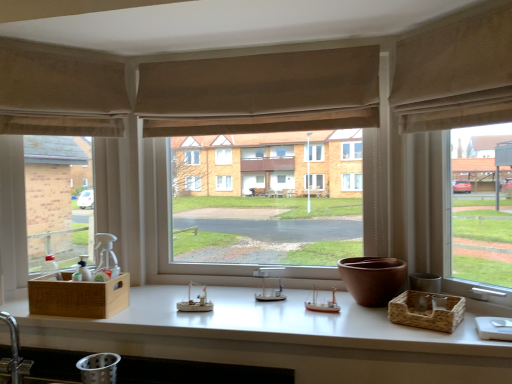
At what (x,y) coordinates should I click in order to perform the action: click on silver metallic faucet at lower left. Please return your answer as a coordinate pair (x, y). Looking at the image, I should click on (13, 345).

How much space does matte beige curtain at center, acting as the 2th window starting from the left, occupy vertically?

3.41 feet.

Identify the location of brown woven basket at right, the 2th basket from the left. point(426,311).

Image resolution: width=512 pixels, height=384 pixels. I want to click on vase behind the white matte countertop at center, so click(372, 279).

Is brown matte vase at center at the back of white matte countertop at center?

No, brown matte vase at center is not at the back of white matte countertop at center.

From a real-world perspective, is white matte countertop at center over brown matte vase at center?

No, from a real-world perspective, white matte countertop at center is not over brown matte vase at center

Considering the positions of objects matte beige curtain at center, acting as the 2th window starting from the left, and white matte countertop at center in the image provided, who is more to the left, matte beige curtain at center, acting as the 2th window starting from the left, or white matte countertop at center?

white matte countertop at center.

Would you say matte beige curtain at center, acting as the 2th window starting from the left, is inside or outside white matte countertop at center?

matte beige curtain at center, acting as the 2th window starting from the left, lies outside white matte countertop at center.

Is matte beige curtain at center, placed as the 2th window when sorted from right to left, facing away from white matte countertop at center?

No, matte beige curtain at center, placed as the 2th window when sorted from right to left, is not facing away from white matte countertop at center.

From the image's perspective, is brown matte vase at center on matte beige curtain at center, acting as the 2th window starting from the left?

No, from the image's perspective, brown matte vase at center is not on top of matte beige curtain at center, acting as the 2th window starting from the left.

From the picture: Considering the positions of objects brown matte vase at center and matte beige curtain at center, placed as the 2th window when sorted from right to left, in the image provided, who is in front, brown matte vase at center or matte beige curtain at center, placed as the 2th window when sorted from right to left,?

Positioned in front is brown matte vase at center.

From a real-world perspective, which is physically above, brown matte vase at center or matte beige curtain at center, acting as the 2th window starting from the left?

matte beige curtain at center, acting as the 2th window starting from the left, is physically above.

In the image, is brown matte vase at center on the left side or the right side of matte beige curtain at center, placed as the 2th window when sorted from right to left?

Clearly, brown matte vase at center is on the right of matte beige curtain at center, placed as the 2th window when sorted from right to left, in the image.

Does white matte countertop at center contain beige textured curtain at center, the second curtain when ordered from right to left?

No, beige textured curtain at center, the second curtain when ordered from right to left, is located outside of white matte countertop at center.

Based on the photo, from the image's perspective, is white matte countertop at center under beige textured curtain at center, the second curtain when ordered from right to left?

Yes, from the image's perspective, white matte countertop at center is beneath beige textured curtain at center, the second curtain when ordered from right to left.

From their relative heights in the image, would you say white matte countertop at center is taller or shorter than beige textured curtain at center, the first curtain viewed from the back?

In the image, white matte countertop at center appears to be shorter than beige textured curtain at center, the first curtain viewed from the back.

Looking at the image, does white matte countertop at center seem bigger or smaller compared to beige textured curtain at center, the second curtain positioned from the front?

In the image, white matte countertop at center appears to be larger than beige textured curtain at center, the second curtain positioned from the front.

Is wooden crate at left, the third window from the right, at the back of matte beige curtain at right, which appears as the first window when viewed from the right?

No, wooden crate at left, the third window from the right, is not at the back of matte beige curtain at right, which appears as the first window when viewed from the right.

Is matte beige curtain at right, which appears as the first window when viewed from the right, taller or shorter than wooden crate at left, which is the 1th window in left-to-right order?

matte beige curtain at right, which appears as the first window when viewed from the right, is taller than wooden crate at left, which is the 1th window in left-to-right order.

Which is nearer, (481, 266) or (42, 214)?

Point (481, 266) is positioned farther from the camera compared to point (42, 214).

Which object is more forward, matte beige curtain at right, which is counted as the third window, starting from the left, or wooden crate at left, the third window from the right?

matte beige curtain at right, which is counted as the third window, starting from the left, is in front.

Considering the positions of objects beige fabric curtain at upper right, which appears as the 2th curtain when viewed from the back, and matte beige curtain at center, placed as the 2th window when sorted from right to left, in the image provided, who is more to the left, beige fabric curtain at upper right, which appears as the 2th curtain when viewed from the back, or matte beige curtain at center, placed as the 2th window when sorted from right to left,?

matte beige curtain at center, placed as the 2th window when sorted from right to left.

Looking at this image, is the surface of beige fabric curtain at upper right, arranged as the first curtain when viewed from the right, in direct contact with matte beige curtain at center, acting as the 2th window starting from the left?

There is a gap between beige fabric curtain at upper right, arranged as the first curtain when viewed from the right, and matte beige curtain at center, acting as the 2th window starting from the left.

Consider the image. Can matte beige curtain at center, acting as the 2th window starting from the left, be found inside beige fabric curtain at upper right, arranged as the first curtain when viewed from the right?

That's incorrect, matte beige curtain at center, acting as the 2th window starting from the left, is not inside beige fabric curtain at upper right, arranged as the first curtain when viewed from the right.

Does beige fabric curtain at upper right, which appears as the 2th curtain when viewed from the back, turn towards matte beige curtain at center, acting as the 2th window starting from the left?

No, beige fabric curtain at upper right, which appears as the 2th curtain when viewed from the back, is not oriented towards matte beige curtain at center, acting as the 2th window starting from the left.

Is silver metallic faucet at lower left in contact with matte beige curtain at right, which appears as the first window when viewed from the right?

No.

From the image's perspective, is silver metallic faucet at lower left positioned above or below matte beige curtain at right, which appears as the first window when viewed from the right?

silver metallic faucet at lower left is below matte beige curtain at right, which appears as the first window when viewed from the right.

Is silver metallic faucet at lower left taller than matte beige curtain at right, which appears as the first window when viewed from the right?

Incorrect, the height of silver metallic faucet at lower left is not larger of that of matte beige curtain at right, which appears as the first window when viewed from the right.

Where is `counter top located underneath the brown matte vase at center (from a real-world perspective)`? The width and height of the screenshot is (512, 384). counter top located underneath the brown matte vase at center (from a real-world perspective) is located at coordinates (277, 338).

From a real-world perspective, which window is the 2nd one above the white matte countertop at center? Please provide its 2D coordinates.

[(279, 213)]

Estimate the real-world distances between objects in this image. Which object is further from wooden crate at left, which is the 1th window in left-to-right order, silver metallic faucet at lower left or matte beige curtain at center, placed as the 2th window when sorted from right to left?

The object further to wooden crate at left, which is the 1th window in left-to-right order, is matte beige curtain at center, placed as the 2th window when sorted from right to left.

Estimate the real-world distances between objects in this image. Which object is further from matte beige curtain at center, placed as the 2th window when sorted from right to left, beige fabric curtain at upper right, the 1th curtain when ordered from front to back, or matte beige curtain at right, which is counted as the third window, starting from the left?

matte beige curtain at right, which is counted as the third window, starting from the left, lies further to matte beige curtain at center, placed as the 2th window when sorted from right to left, than the other object.

Considering their positions, is beige fabric curtain at upper right, placed as the second curtain when sorted from left to right, positioned closer to brown matte vase at center than beige textured curtain at center, the second curtain positioned from the front?

beige fabric curtain at upper right, placed as the second curtain when sorted from left to right, is closer to brown matte vase at center.

Based on their spatial positions, is white matte countertop at center or wooden woven basket at left, which is the first basket from left to right, closer to silver metallic faucet at lower left?

wooden woven basket at left, which is the first basket from left to right, lies closer to silver metallic faucet at lower left than the other object.

When comparing their distances from wooden woven basket at left, which is counted as the 2th basket, starting from the right, does beige textured curtain at center, the second curtain when ordered from right to left, or brown matte vase at center seem closer?

beige textured curtain at center, the second curtain when ordered from right to left.

Considering their positions, is white matte countertop at center positioned further to beige textured curtain at center, the second curtain when ordered from right to left, than wooden woven basket at left, which is the first basket from left to right?

wooden woven basket at left, which is the first basket from left to right, lies further to beige textured curtain at center, the second curtain when ordered from right to left, than the other object.

Estimate the real-world distances between objects in this image. Which object is further from matte beige curtain at right, which is counted as the third window, starting from the left, brown matte vase at center or wooden crate at left, which is the 1th window in left-to-right order?

The object further to matte beige curtain at right, which is counted as the third window, starting from the left, is wooden crate at left, which is the 1th window in left-to-right order.

Looking at the image, which one is located closer to matte beige curtain at center, placed as the 2th window when sorted from right to left, beige fabric curtain at upper right, arranged as the first curtain when viewed from the right, or beige textured curtain at center, the second curtain positioned from the front?

The object closer to matte beige curtain at center, placed as the 2th window when sorted from right to left, is beige textured curtain at center, the second curtain positioned from the front.

I want to click on curtain between wooden crate at left, which is the 1th window in left-to-right order, and brown matte vase at center, so click(261, 93).

Where is `basket between wooden crate at left, the third window from the right, and white matte countertop at center from left to right`? This screenshot has height=384, width=512. basket between wooden crate at left, the third window from the right, and white matte countertop at center from left to right is located at coordinates coord(78,296).

Locate an element on the screen. The height and width of the screenshot is (384, 512). vase between matte beige curtain at right, which appears as the first window when viewed from the right, and brown woven basket at right, the 2th basket from the left, in the up-down direction is located at coordinates (372, 279).

You are a GUI agent. You are given a task and a screenshot of the screen. Output one action in this format:
    pyautogui.click(x=<x>, y=<y>)
    Task: Click on the vase between wooden crate at left, the third window from the right, and matte beige curtain at right, which is counted as the third window, starting from the left
    The image size is (512, 384).
    Given the screenshot: What is the action you would take?
    (x=372, y=279)